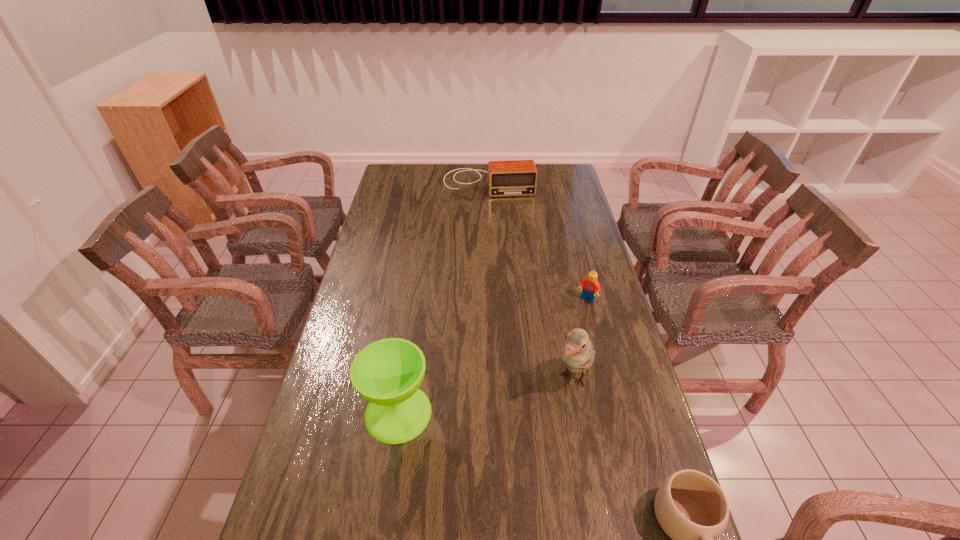
You are a GUI agent. You are given a task and a screenshot of the screen. Output one action in this format:
    pyautogui.click(x=<x>, y=<y>)
    Task: Click on the vacant point located 0.220m on the face of the Lego
    The height and width of the screenshot is (540, 960).
    Given the screenshot: What is the action you would take?
    pyautogui.click(x=555, y=349)

What are the coordinates of `vacant space located 0.190m on the front-facing side of the radio receiver` in the screenshot? It's located at (495, 222).

In order to click on vacant space located 0.050m on the front-facing side of the radio receiver in this screenshot , I will do `click(492, 204)`.

What are the coordinates of `vacant area located on the front-facing side of the radio receiver` in the screenshot? It's located at (494, 217).

Image resolution: width=960 pixels, height=540 pixels. Identify the location of object situated at the far edge. (515, 177).

Identify the location of object that is at the left edge. (387, 373).

Identify the location of bird at the right edge. The height and width of the screenshot is (540, 960). (578, 355).

Locate an element on the screen. This screenshot has height=540, width=960. Lego at the right edge is located at coordinates (591, 287).

Locate an element on the screen. The width and height of the screenshot is (960, 540). blank space at the far edge of the desktop is located at coordinates (440, 173).

This screenshot has width=960, height=540. Find the location of `vacant space at the near edge`. vacant space at the near edge is located at coordinates (491, 519).